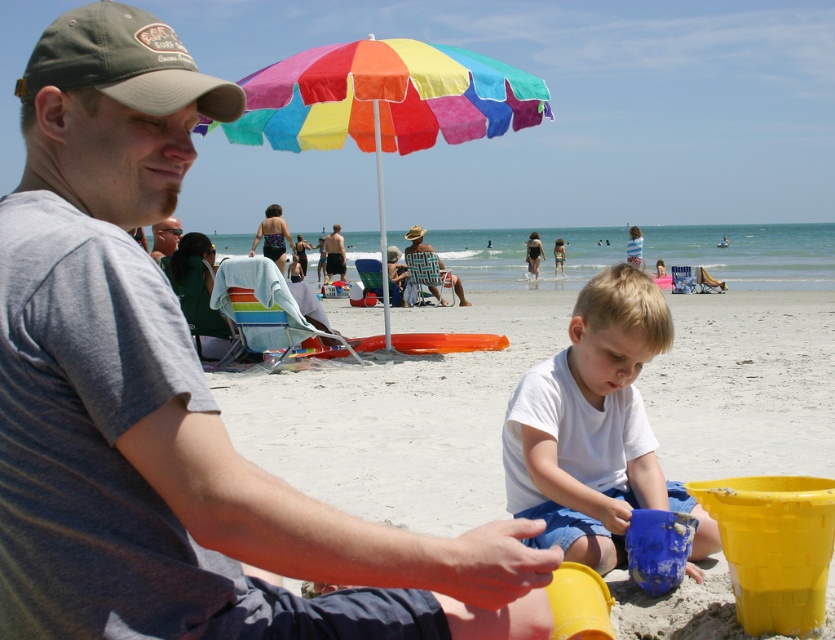
You are a photographer trying to capture a clear shot of the man in the gray tshirt and the young boy. You notice the green fabric baseball cap at left and the matte black sunglasses at upper left in your frame. Which object should you adjust to avoid blocking the view of the man and the boy?

The green fabric baseball cap at left is in front of the matte black sunglasses at upper left, so you should adjust the green fabric baseball cap at left to avoid blocking the view of the man and the boy.

You are a photographer trying to capture a photo of the matte black swimsuit at center without the rainbow fabric umbrella at upper center blocking it. Is this possible given their positions?

The rainbow fabric umbrella at upper center is in front of the matte black swimsuit at center, so it is blocking the view. To capture the photo without the umbrella blocking, you would need to move to a different angle or position where the umbrella is not in front.